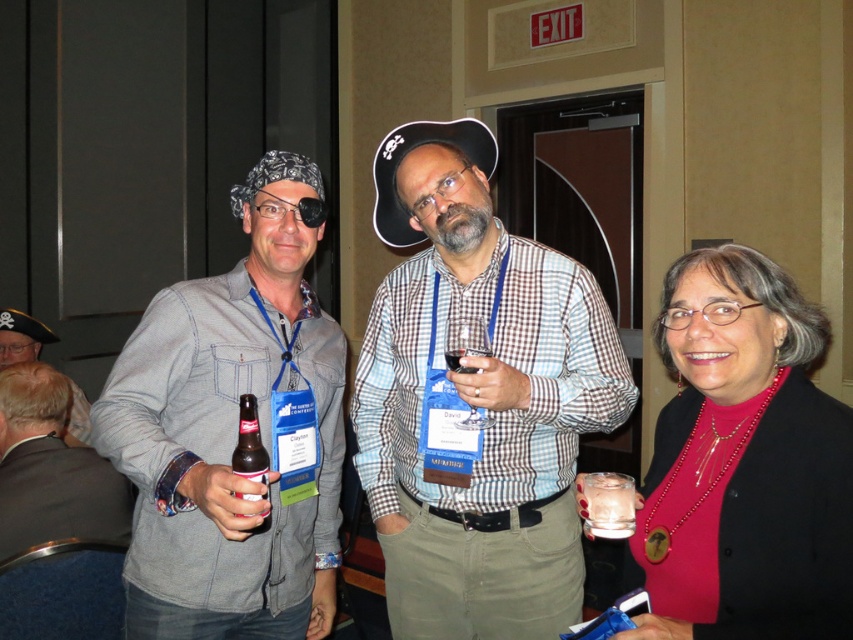
Who is positioned more to the right, checkered fabric shirt at center or clear glass cup at lower right?

Positioned to the right is clear glass cup at lower right.

Does point (450, 227) lie behind point (585, 525)?

Yes, it is behind point (585, 525).

Is point (479, 172) closer to camera compared to point (601, 484)?

No.

Find the location of `checkered fabric shirt at center`. checkered fabric shirt at center is located at coordinates (477, 401).

Consider the image. Does denim shirt at left have a greater width compared to brown glass bottle at center?

Indeed, denim shirt at left has a greater width compared to brown glass bottle at center.

Measure the distance between denim shirt at left and camera.

The distance of denim shirt at left from camera is 3.80 feet.

Image resolution: width=853 pixels, height=640 pixels. I want to click on denim shirt at left, so click(x=231, y=433).

Is matte black blazer at center to the right of clear glass wine at center from the viewer's perspective?

Indeed, matte black blazer at center is positioned on the right side of clear glass wine at center.

Does point (788, 403) come in front of point (490, 353)?

That is True.

You are a GUI agent. You are given a task and a screenshot of the screen. Output one action in this format:
    pyautogui.click(x=<x>, y=<y>)
    Task: Click on the matte black blazer at center
    Image resolution: width=853 pixels, height=640 pixels.
    Given the screenshot: What is the action you would take?
    pyautogui.click(x=746, y=460)